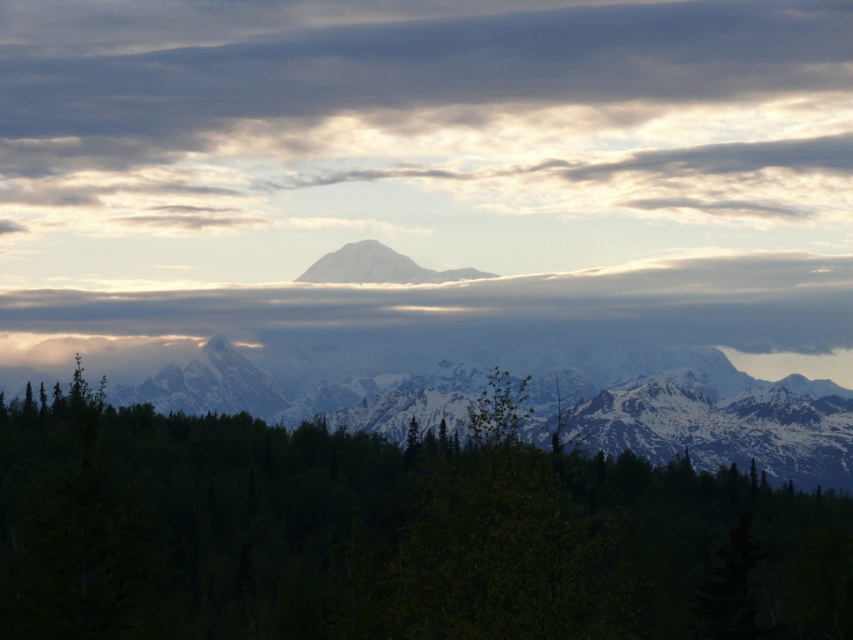
Can you confirm if green leafy forest at center is positioned below white snow-covered mountain at center?

Indeed, green leafy forest at center is positioned under white snow-covered mountain at center.

I want to click on green leafy forest at center, so point(392,534).

Identify the location of green leafy forest at center. This screenshot has height=640, width=853. (392, 534).

This screenshot has height=640, width=853. What are the coordinates of `green leafy forest at center` in the screenshot? It's located at (392, 534).

Is snowy mountain range at center above white snow-covered mountain at center?

No.

Who is positioned more to the left, snowy mountain range at center or white snow-covered mountain at center?

white snow-covered mountain at center

You are a GUI agent. You are given a task and a screenshot of the screen. Output one action in this format:
    pyautogui.click(x=<x>, y=<y>)
    Task: Click on the snowy mountain range at center
    Image resolution: width=853 pixels, height=640 pixels.
    Given the screenshot: What is the action you would take?
    pyautogui.click(x=706, y=419)

Can you confirm if green leafy forest at center is smaller than smokey gray cloud at center?

No.

I want to click on green leafy forest at center, so click(392, 534).